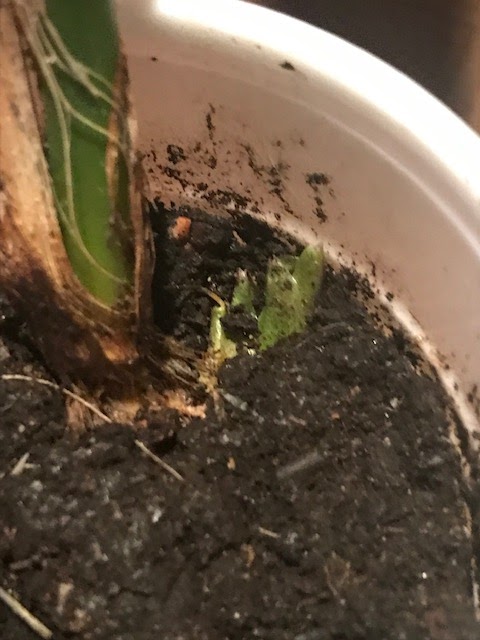
You are a GUI agent. You are given a task and a screenshot of the screen. Output one action in this format:
    pyautogui.click(x=<x>, y=<y>)
    Task: Click on the mid rim of plant pot
    
    Given the screenshot: What is the action you would take?
    pos(405,316)